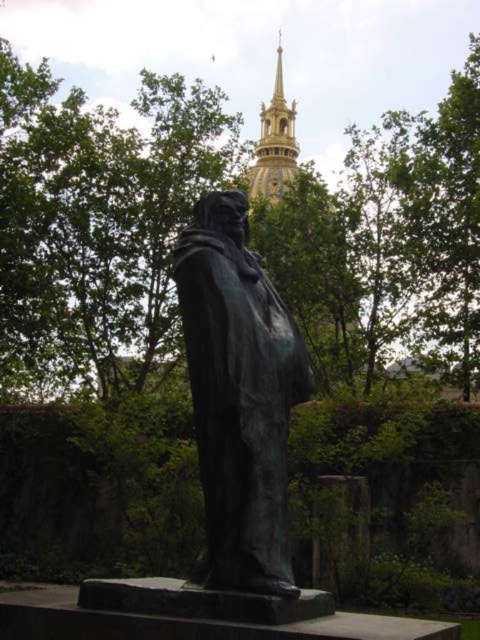
Does bronze statue at center appear over gold textured spire at upper center?

No, bronze statue at center is not above gold textured spire at upper center.

Can you confirm if bronze statue at center is smaller than gold textured spire at upper center?

Yes, bronze statue at center is smaller than gold textured spire at upper center.

What do you see at coordinates (239, 396) in the screenshot?
I see `bronze statue at center` at bounding box center [239, 396].

Locate an element on the screen. Image resolution: width=480 pixels, height=640 pixels. bronze statue at center is located at coordinates (239, 396).